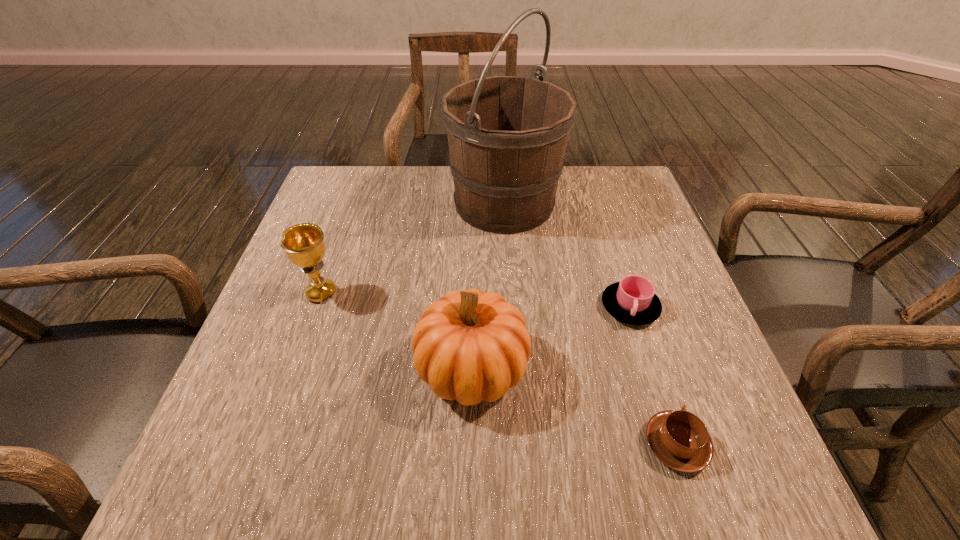
The image size is (960, 540). Identify the location of blank region between the cappuccino and the tallest object. (590, 323).

Image resolution: width=960 pixels, height=540 pixels. I want to click on empty space between the cup and the farthest object, so click(x=567, y=255).

This screenshot has height=540, width=960. Identify the location of blank region between the shortest object and the cup. (x=653, y=375).

Identify the location of free space that is in between the cappuccino and the pumpkin. The height and width of the screenshot is (540, 960). (574, 406).

Find the location of a particular element. object that ranks as the fourth closest to the leftmost object is located at coordinates (679, 439).

Identify which object is the second nearest to the cappuccino. Please provide its 2D coordinates. Your answer should be formatted as a tuple, i.e. [(x, y)], where the tuple contains the x and y coordinates of a point satisfying the conditions above.

[(633, 300)]

The height and width of the screenshot is (540, 960). In order to click on vacant point that satisfies the following two spatial constraints: 1. on the back side of the bucket; 2. on the right side of the leftmost object in this screenshot , I will do `click(353, 203)`.

I want to click on free space that satisfies the following two spatial constraints: 1. on the back side of the pumpkin; 2. on the right side of the bucket, so click(474, 203).